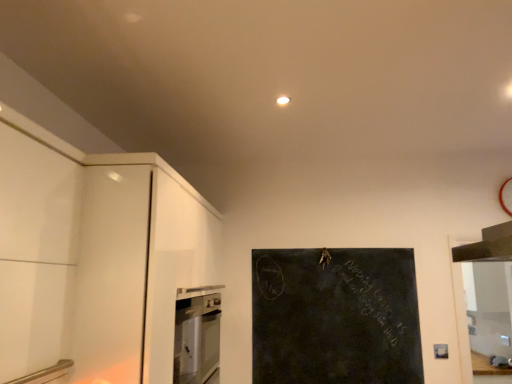
The width and height of the screenshot is (512, 384). What do you see at coordinates (197, 339) in the screenshot?
I see `satin stainless steel dishwasher at lower left` at bounding box center [197, 339].

Locate an element on the screen. satin stainless steel dishwasher at lower left is located at coordinates (197, 339).

What do you see at coordinates (335, 316) in the screenshot?
I see `black chalkboard at center` at bounding box center [335, 316].

At what (x,y) coordinates should I click in order to perform the action: click on black chalkboard at center. Please return your answer as a coordinate pair (x, y). The height and width of the screenshot is (384, 512). Looking at the image, I should click on (335, 316).

Locate an element on the screen. This screenshot has height=384, width=512. satin stainless steel dishwasher at lower left is located at coordinates click(197, 339).

Which is more to the right, satin stainless steel dishwasher at lower left or black chalkboard at center?

black chalkboard at center.

Which is in front, satin stainless steel dishwasher at lower left or black chalkboard at center?

satin stainless steel dishwasher at lower left is more forward.

Is point (209, 299) closer or farther from the camera than point (377, 347)?

Point (209, 299) is positioned closer to the camera compared to point (377, 347).

From the image's perspective, which is below, satin stainless steel dishwasher at lower left or black chalkboard at center?

satin stainless steel dishwasher at lower left, from the image's perspective.

From a real-world perspective, which object rests below the other?

satin stainless steel dishwasher at lower left is physically lower.

Can you confirm if satin stainless steel dishwasher at lower left is thinner than black chalkboard at center?

No, satin stainless steel dishwasher at lower left is not thinner than black chalkboard at center.

Who is shorter, satin stainless steel dishwasher at lower left or black chalkboard at center?

satin stainless steel dishwasher at lower left is shorter.

Can you confirm if satin stainless steel dishwasher at lower left is smaller than black chalkboard at center?

Incorrect, satin stainless steel dishwasher at lower left is not smaller in size than black chalkboard at center.

Is satin stainless steel dishwasher at lower left completely or partially outside of black chalkboard at center?

Yes, satin stainless steel dishwasher at lower left is located beyond the bounds of black chalkboard at center.

Consider the image. Is satin stainless steel dishwasher at lower left next to black chalkboard at center and touching it?

No, satin stainless steel dishwasher at lower left is not with black chalkboard at center.

Is satin stainless steel dishwasher at lower left oriented away from black chalkboard at center?

satin stainless steel dishwasher at lower left is not turned away from black chalkboard at center.

Where is `home appliance below the black chalkboard at center (from the image's perspective)`? Image resolution: width=512 pixels, height=384 pixels. home appliance below the black chalkboard at center (from the image's perspective) is located at coordinates (197, 339).

Is black chalkboard at center at the right side of satin stainless steel dishwasher at lower left?

Yes.

In the image, is black chalkboard at center positioned in front of or behind satin stainless steel dishwasher at lower left?

black chalkboard at center is behind satin stainless steel dishwasher at lower left.

Between point (303, 255) and point (206, 331), which one is positioned in front?

Positioned in front is point (206, 331).

From the image's perspective, between black chalkboard at center and satin stainless steel dishwasher at lower left, who is located below?

satin stainless steel dishwasher at lower left is shown below in the image.

From a real-world perspective, is black chalkboard at center located beneath satin stainless steel dishwasher at lower left?

No.

In the scene shown: Considering the sizes of objects black chalkboard at center and satin stainless steel dishwasher at lower left in the image provided, who is thinner, black chalkboard at center or satin stainless steel dishwasher at lower left?

With smaller width is black chalkboard at center.

Which of these two, black chalkboard at center or satin stainless steel dishwasher at lower left, stands shorter?

satin stainless steel dishwasher at lower left is shorter.

Considering the relative sizes of black chalkboard at center and satin stainless steel dishwasher at lower left in the image provided, is black chalkboard at center bigger than satin stainless steel dishwasher at lower left?

No, black chalkboard at center is not bigger than satin stainless steel dishwasher at lower left.

Does black chalkboard at center contain satin stainless steel dishwasher at lower left?

No, satin stainless steel dishwasher at lower left is not a part of black chalkboard at center.

Is black chalkboard at center placed right next to satin stainless steel dishwasher at lower left?

There is a gap between black chalkboard at center and satin stainless steel dishwasher at lower left.

Is black chalkboard at center oriented away from satin stainless steel dishwasher at lower left?

No.

What's the angular difference between black chalkboard at center and satin stainless steel dishwasher at lower left's facing directions?

black chalkboard at center and satin stainless steel dishwasher at lower left are facing 91.1 degrees away from each other.

What are the coordinates of `home appliance below the black chalkboard at center (from the image's perspective)` in the screenshot? It's located at tap(197, 339).

Identify the location of home appliance below the black chalkboard at center (from a real-world perspective). (197, 339).

I want to click on home appliance that appears on the left of black chalkboard at center, so click(197, 339).